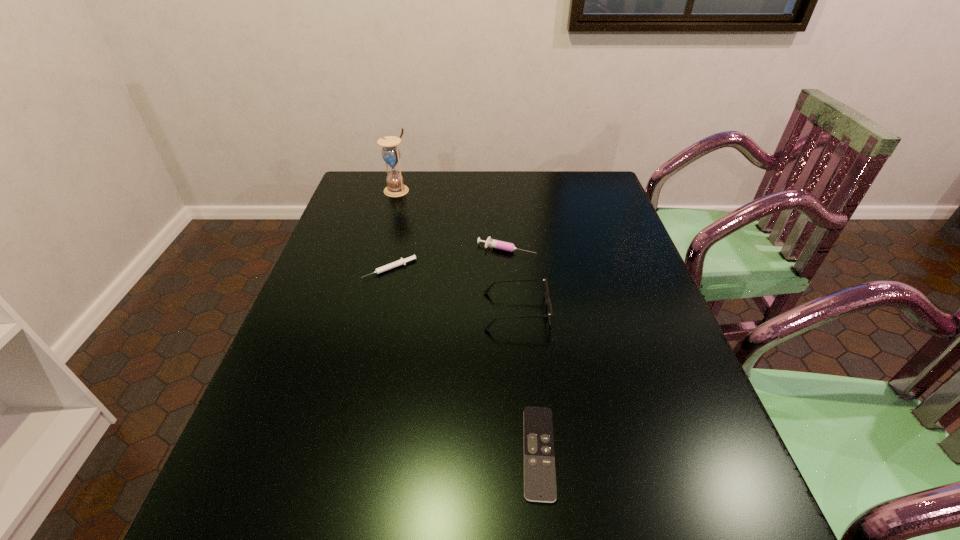
The image size is (960, 540). What are the coordinates of `free space between the shortest object and the tallest object` in the screenshot? It's located at pyautogui.click(x=468, y=321).

You are a GUI agent. You are given a task and a screenshot of the screen. Output one action in this format:
    pyautogui.click(x=<x>, y=<y>)
    Task: Click on the vacant region between the left syringe and the second tallest object
    
    Given the screenshot: What is the action you would take?
    pyautogui.click(x=453, y=290)

Where is `empty location between the nearest object and the shorter syringe`? Image resolution: width=960 pixels, height=540 pixels. empty location between the nearest object and the shorter syringe is located at coordinates (465, 361).

Where is `free space between the fourth farthest object and the nearest object`? Image resolution: width=960 pixels, height=540 pixels. free space between the fourth farthest object and the nearest object is located at coordinates (527, 382).

What are the coordinates of `object that is the second closest to the hourglass` in the screenshot? It's located at (506, 246).

Select which object appears as the fourth closest to the tallest object. Please provide its 2D coordinates. Your answer should be formatted as a tuple, i.e. [(x, y)], where the tuple contains the x and y coordinates of a point satisfying the conditions above.

[(539, 459)]

At what (x,y) coordinates should I click in order to perform the action: click on free space that satisfies the following two spatial constraints: 1. on the back side of the left syringe; 2. on the right side of the right syringe. Please return your answer as a coordinate pair (x, y). Looking at the image, I should click on (395, 249).

You are a GUI agent. You are given a task and a screenshot of the screen. Output one action in this format:
    pyautogui.click(x=<x>, y=<y>)
    Task: Click on the vacant space that satisfies the following two spatial constraints: 1. on the back side of the shortest object; 2. with the lenses facing outward on the spectacles
    Image resolution: width=960 pixels, height=540 pixels.
    Given the screenshot: What is the action you would take?
    pyautogui.click(x=524, y=311)